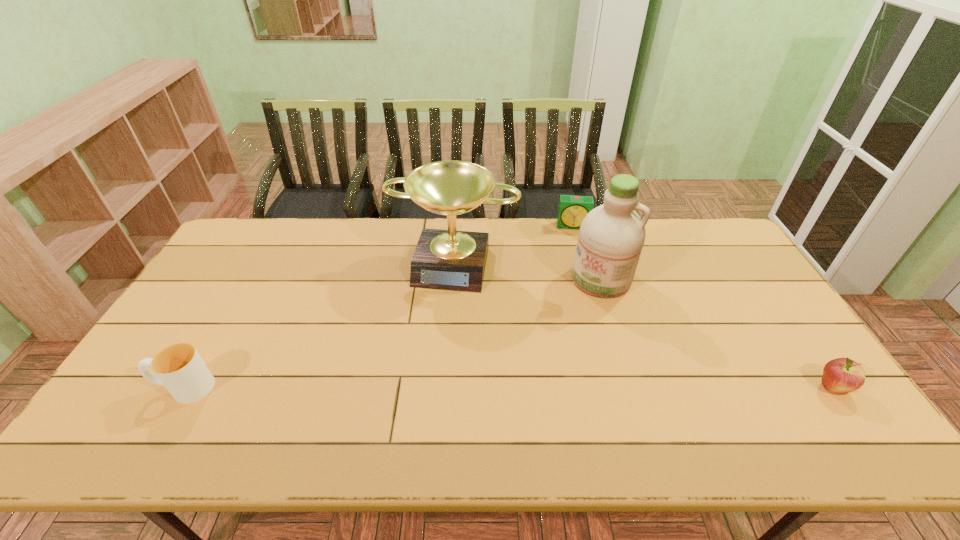
Find the location of a particular element. the leftmost object is located at coordinates (179, 367).

I want to click on the rightmost object, so click(842, 375).

At what (x,y) coordinates should I click in order to perform the action: click on award. Please return your answer as a coordinate pair (x, y). Looking at the image, I should click on (453, 260).

You are a GUI agent. You are given a task and a screenshot of the screen. Output one action in this format:
    pyautogui.click(x=<x>, y=<y>)
    Task: Click on the fourth object from right to left
    The height and width of the screenshot is (540, 960).
    Given the screenshot: What is the action you would take?
    pyautogui.click(x=453, y=260)

This screenshot has width=960, height=540. Find the location of `alarm clock`. alarm clock is located at coordinates click(x=572, y=210).

The height and width of the screenshot is (540, 960). What are the coordinates of `cleansing agent` in the screenshot? It's located at (611, 237).

The image size is (960, 540). What are the coordinates of `free spot located 0.070m with the handle on the side of the leftmost object` in the screenshot? It's located at (129, 388).

Find the location of `free space located on the back of the rightmost object`. free space located on the back of the rightmost object is located at coordinates (795, 333).

Where is `free space located 0.160m on the front-facing side of the fourth object from right to left`? This screenshot has width=960, height=540. free space located 0.160m on the front-facing side of the fourth object from right to left is located at coordinates (434, 332).

The width and height of the screenshot is (960, 540). Find the location of `free space located on the front-facing side of the fourth object from right to left`. free space located on the front-facing side of the fourth object from right to left is located at coordinates (422, 375).